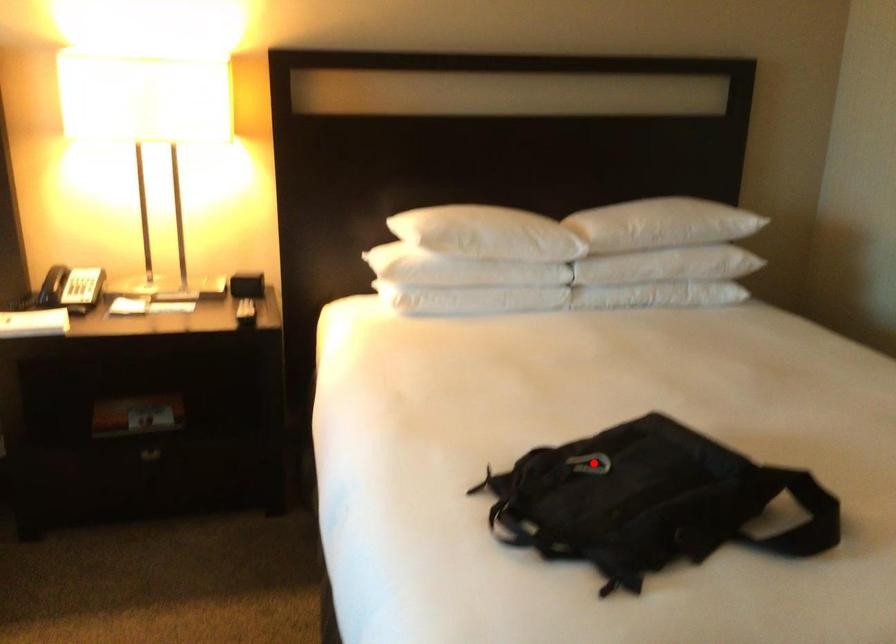
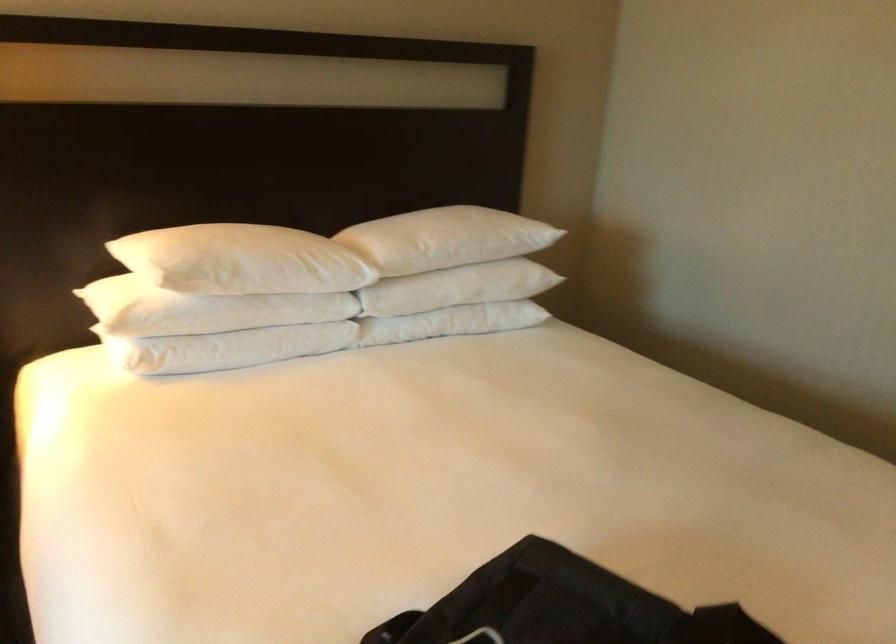
Question: I am providing you with two images of the same scene from different viewpoints. Given a red point in image1, look at the same physical point in image2. Is it:

Choices:
 (A) Closer to the viewpoint
 (B) Farther from the viewpoint

Answer: (A)